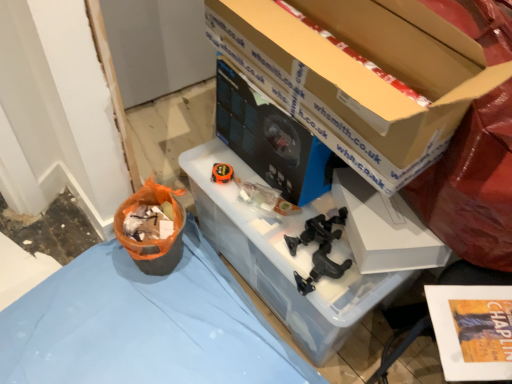
Locate an element on the screen. free spot above clear plastic storage box at center (from a real-world perspective) is located at coordinates (252, 192).